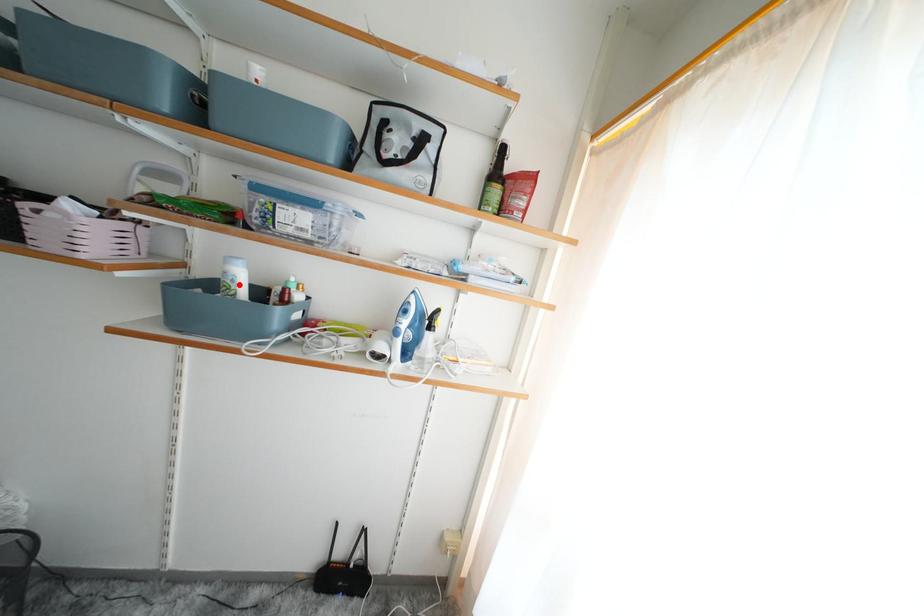
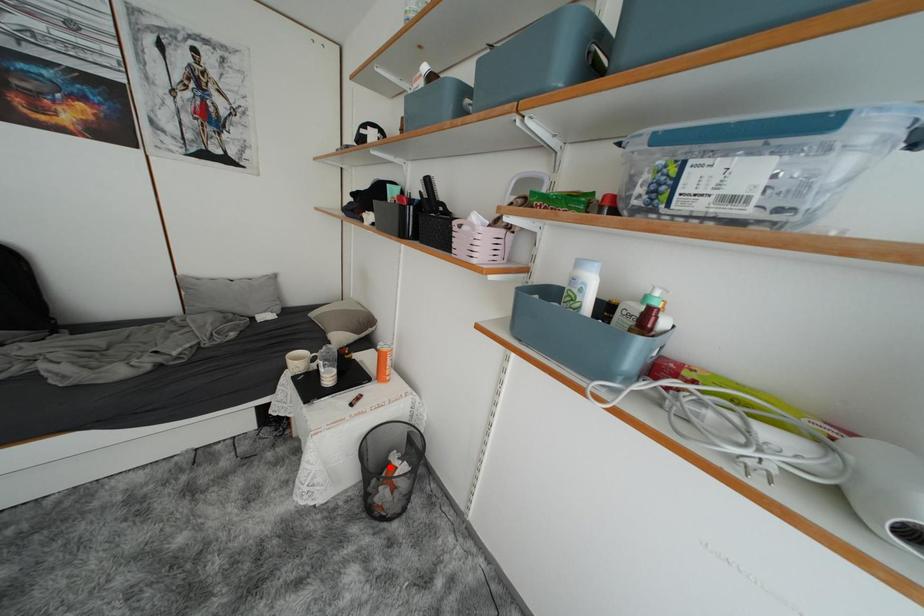
I am providing you with two images of the same scene from different viewpoints. A red point is marked on the first image and another point is marked on the second image. Does the point marked in image1 correspond to the same location as the one in image2?

No